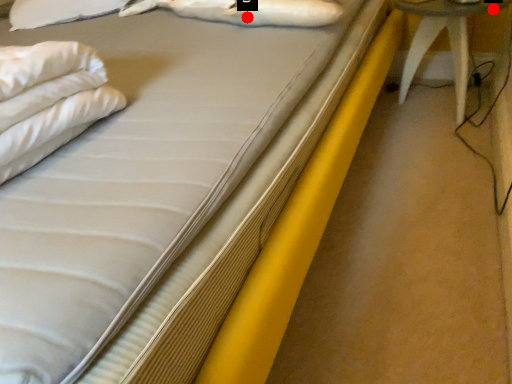
Question: Two points are circled on the image, labeled by A and B beside each circle. Which point appears closest to the camera in this image?

Choices:
 (A) A is closer
 (B) B is closer

Answer: (B)